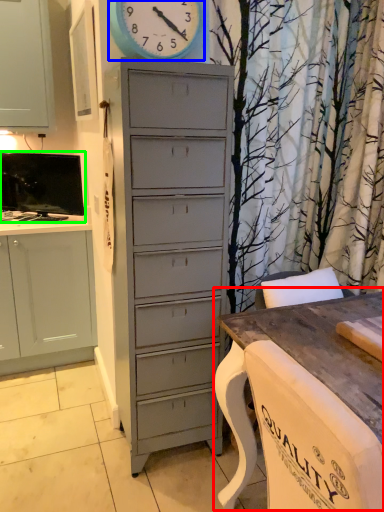
Question: Estimate the real-world distances between objects in this image. Which object is closer to table (highlighted by a red box), clock (highlighted by a blue box) or television (highlighted by a green box)?

Choices:
 (A) clock
 (B) television

Answer: (A)